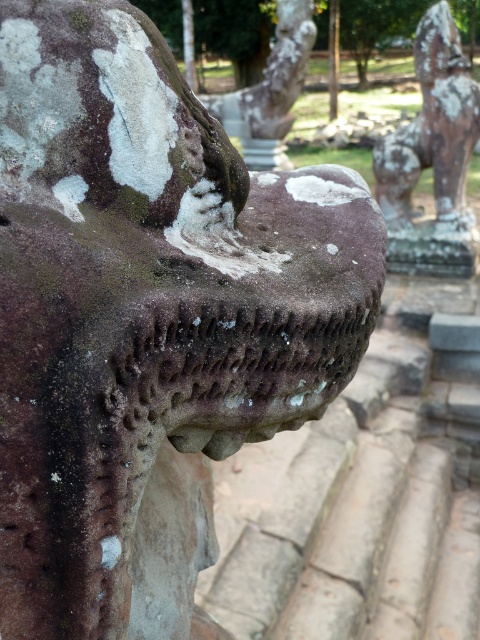
Is rusty stone lion at upper right positioned at the back of rusty stone statue at center?

No.

This screenshot has width=480, height=640. What do you see at coordinates (432, 157) in the screenshot? I see `rusty stone lion at upper right` at bounding box center [432, 157].

Find the location of a particular element. rusty stone lion at upper right is located at coordinates click(x=432, y=157).